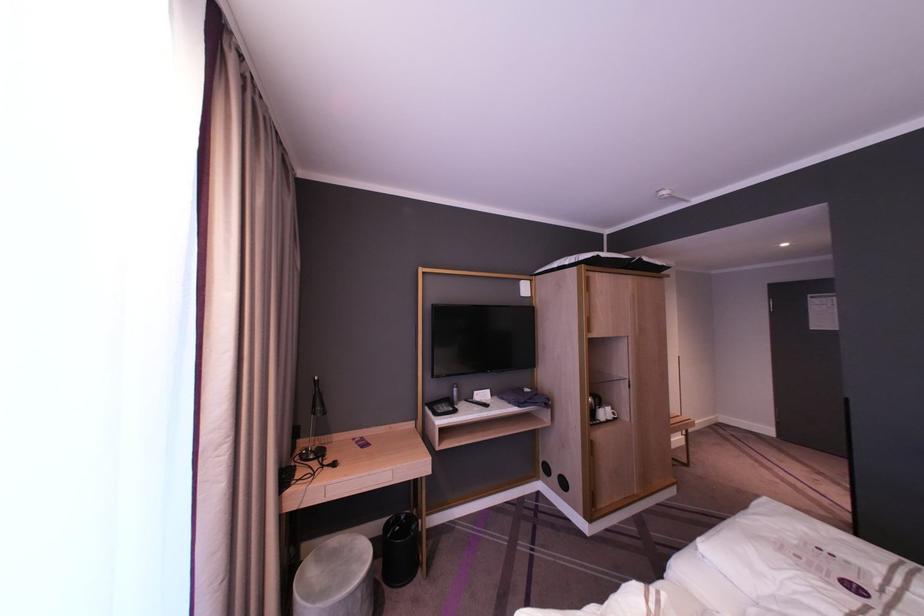
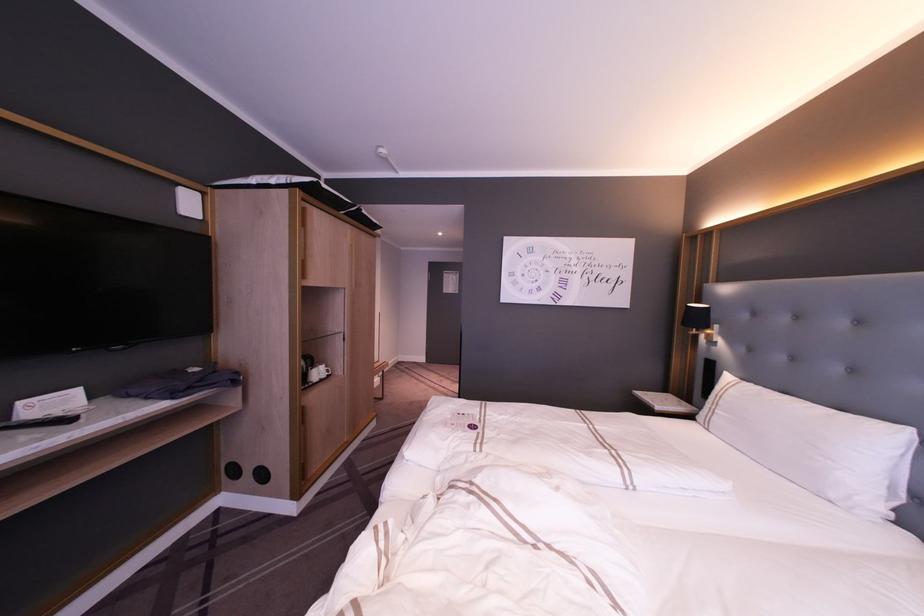
Question: How did the camera likely rotate?

Choices:
 (A) Left
 (B) Right
 (C) Up
 (D) Down

Answer: (B)